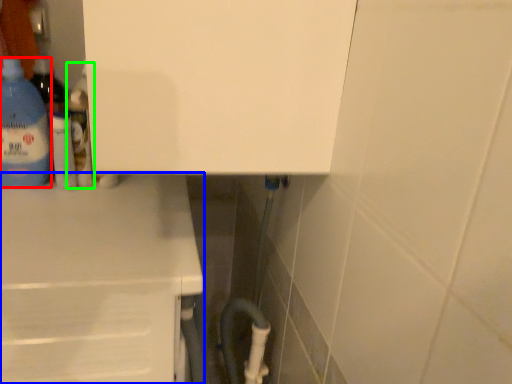
Question: Based on their relative distances, which object is farther from bottle (highlighted by a red box)? Choose from counter (highlighted by a blue box) and bottle (highlighted by a green box).

Choices:
 (A) counter
 (B) bottle

Answer: (A)